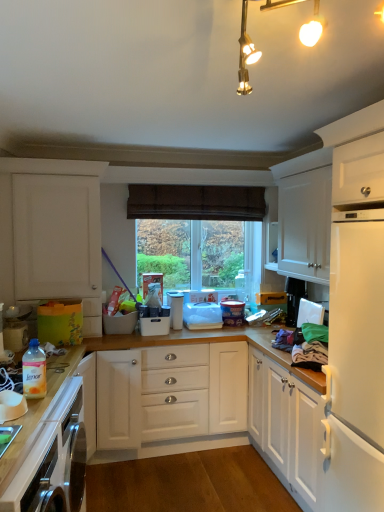
Question: In terms of height, does white plastic container at center, which is counted as the 1th appliance, starting from the back, look taller or shorter compared to white matte cabinet at upper right, which is counted as the second cabinetry, starting from the left?

Choices:
 (A) tall
 (B) short

Answer: (B)

Question: Visually, is white plastic container at center, which is counted as the 4th appliance, starting from the front, positioned to the left or to the right of white matte cabinet at upper right, the 1th cabinetry in the right-to-left sequence?

Choices:
 (A) right
 (B) left

Answer: (B)

Question: Which object is the closest to the white plastic container at center, which appears as the 2th appliance when viewed from the front?

Choices:
 (A) white matte cabinet at upper right, which is counted as the second cabinetry, starting from the left
 (B) wooden countertop at lower left
 (C) transparent plastic window screen at center
 (D) translucent plastic fabric softener at lower left, which is the 1th appliance in left-to-right order
 (E) white matte cabinet at left, marked as the 1th cabinetry in a left-to-right arrangement

Answer: (C)

Question: Considering the real-world distances, which object is closest to the translucent plastic fabric softener at lower left, placed as the fourth appliance when sorted from back to front?

Choices:
 (A) white plastic container at center, which is counted as the 1th appliance, starting from the back
 (B) white plastic container at center, the second appliance in the back-to-front sequence
 (C) white plastic container at center, which is counted as the third appliance, starting from the right
 (D) wooden countertop at lower left
 (E) white matte cabinet at left, which ranks as the second cabinetry in right-to-left order

Answer: (D)